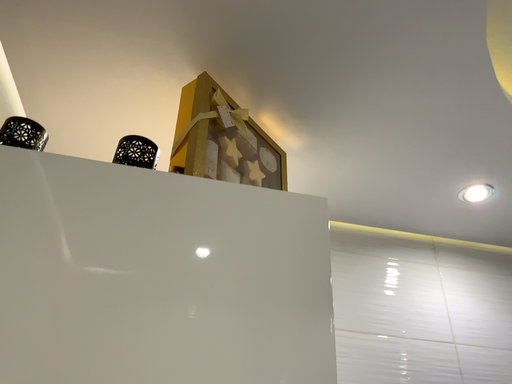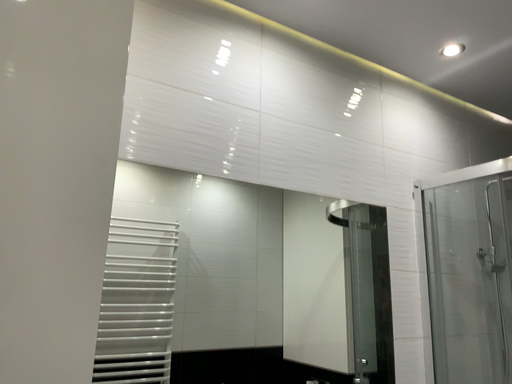
Question: How did the camera likely rotate when shooting the video?

Choices:
 (A) rotated left
 (B) rotated right

Answer: (B)